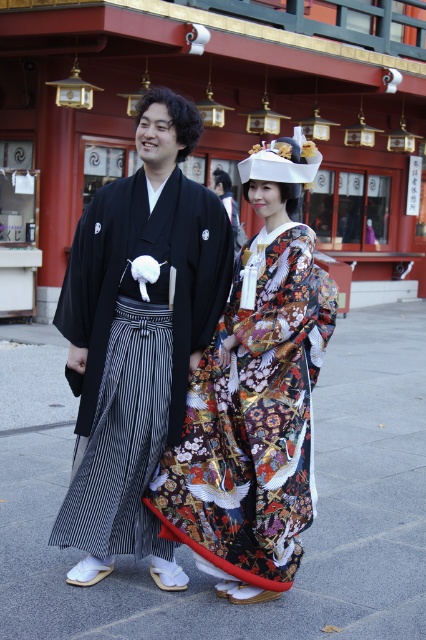
Is black silk kimono at center thinner than colorful silk kimono at center?

No.

Locate an element on the screen. black silk kimono at center is located at coordinates (137, 337).